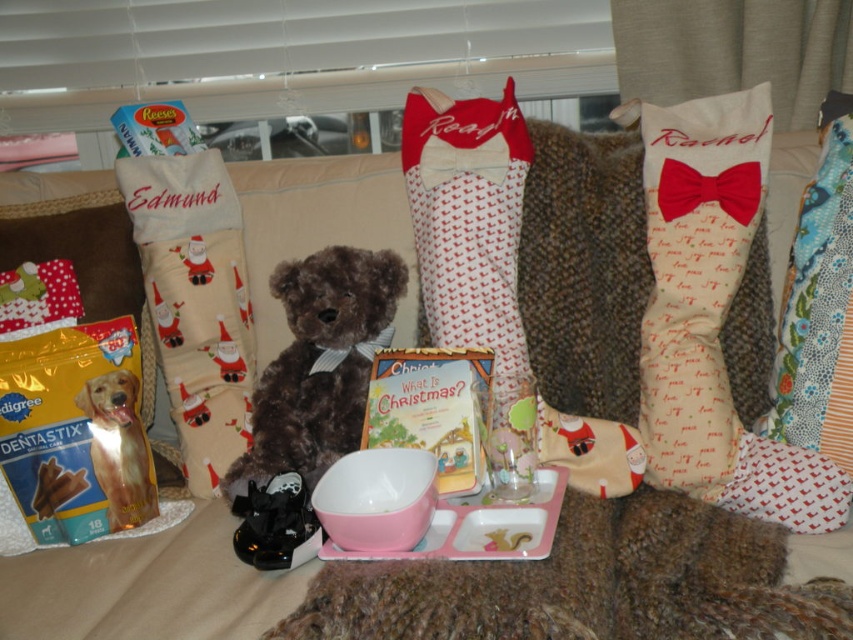
You are organizing a Christmas display and need to place the brown plush teddy bear at center and the floral fabric cushion at right on a shelf. The shelf has limited space. Which object requires more horizontal space due to its width?

The brown plush teddy bear at center requires more horizontal space because its width surpasses that of the floral fabric cushion at right.

Consider the image. You are arranging a Christmas display and need to place a small decoration between the beige fabric stocking at left and the floral fabric cushion at right. Based on their positions, where should you place the decoration?

The beige fabric stocking at left is to the left of the floral fabric cushion at right, so you should place the decoration between them in the middle.

You are a child who wants to hug the brown plush teddy bear at center. Can you reach it if you can stretch your arms 1 meter?

The brown plush teddy bear at center is 1.01 meters away from the viewer. Since the child can only stretch their arms 1 meter, they cannot reach the teddy bear.